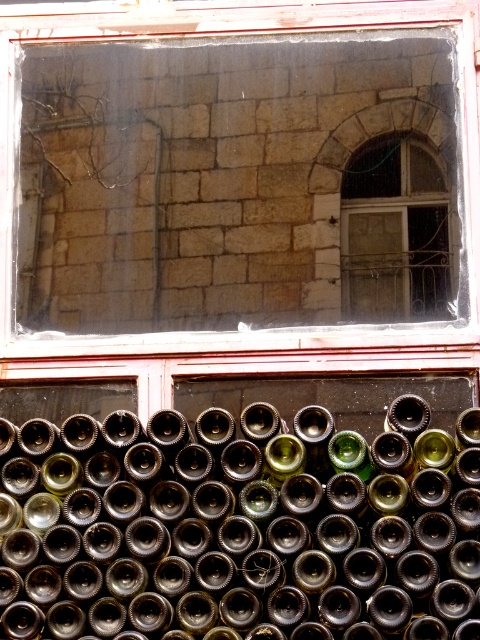
You are an interior designer assessing the lighting in a room. You notice the clear glass window at upper center and the matte glass window at upper right. Which window is positioned higher in the room?

The clear glass window at upper center is positioned higher in the room as it is located above the matte glass window at upper right.

You are standing in front of the window with wine bottles. There are two points marked on the bottles at coordinates point (364,163) and point (379,294). Which point is closer to your eyes?

Point (364,163) is further to the camera than point (379,294), so the closer point to your eyes is point (379,294).

You are a delivery person who needs to place a new wine crate that is 3 meters long in the space between the dark brown glass bottles at bottom and the matte glass window at upper right. Can the crate fit there?

The distance between the dark brown glass bottles at bottom and the matte glass window at upper right is 3.36 meters, so the 3 meter long crate can fit in the space between them.